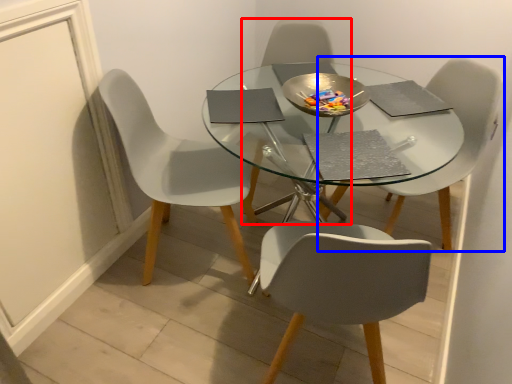
Question: Which object is closer to the camera taking this photo, chair (highlighted by a red box) or chair (highlighted by a blue box)?

Choices:
 (A) chair
 (B) chair

Answer: (B)